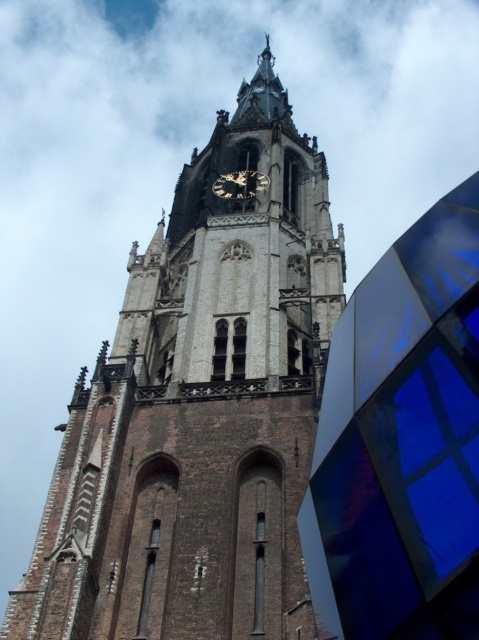
You are standing in front of the historic church and want to take a photo of the brown brick tower at center and the metallic clock face at center. Which object is positioned to the right side in the image?

The brown brick tower at center is positioned to the right of the metallic clock face at center in the image.

You are an architect analyzing the structure of the brown brick tower at center and the metallic clock face at center. Which object has a greater width according to the description?

The brown brick tower at center has a greater width than the metallic clock face at center.